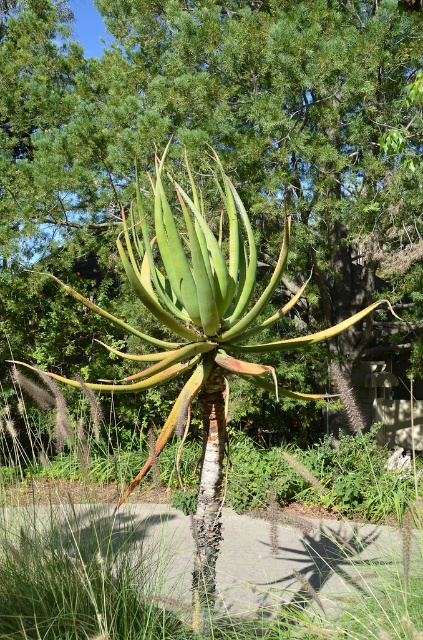
You are a gardener who wants to plant a new flower between the green succulent at center and the green grass at center. Which direction should you dig to avoid disturbing the roots of the existing plants?

The green succulent at center is positioned over green grass at center, so you should dig to the side of the green succulent at center to avoid disturbing the roots of the existing plants.

You are a gardener standing at the edge of a garden. You see the green succulent at center and the green grass at center. Which one is closer to you?

The green grass at center is closer to you because it is only 10.26 meters away from the green succulent at center, which is farther away.